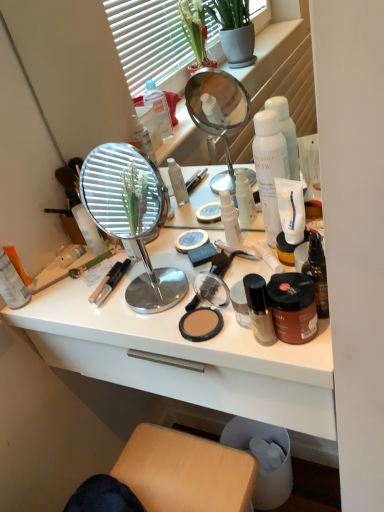
The width and height of the screenshot is (384, 512). What are the coordinates of `free space to the left of silver/metallic mirror at center` in the screenshot? It's located at (79, 301).